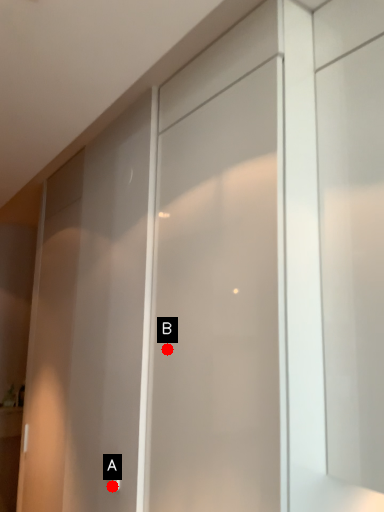
Question: Two points are circled on the image, labeled by A and B beside each circle. Which point appears closest to the camera in this image?

Choices:
 (A) A is closer
 (B) B is closer

Answer: (B)